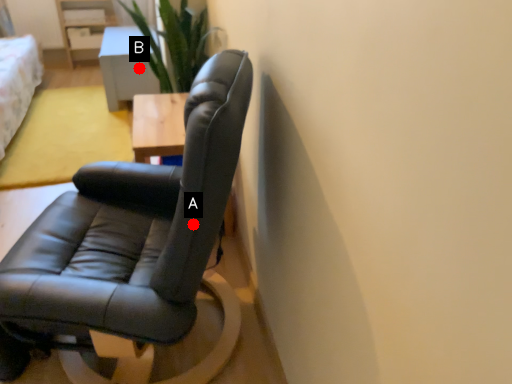
Question: Two points are circled on the image, labeled by A and B beside each circle. Which point is closer to the camera?

Choices:
 (A) A is closer
 (B) B is closer

Answer: (A)